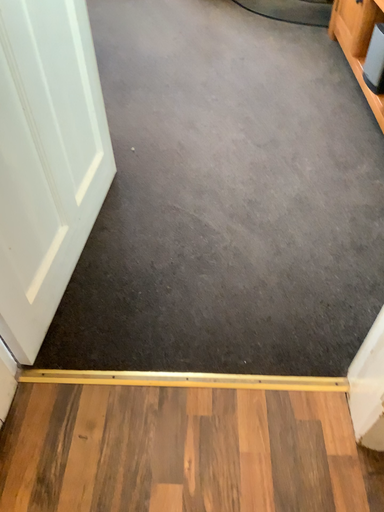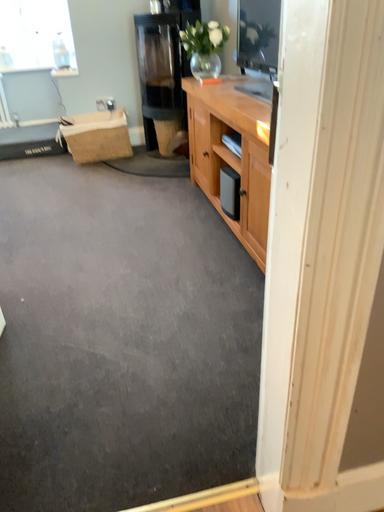
Question: Which way did the camera rotate in the video?

Choices:
 (A) rotated upward
 (B) rotated downward

Answer: (A)